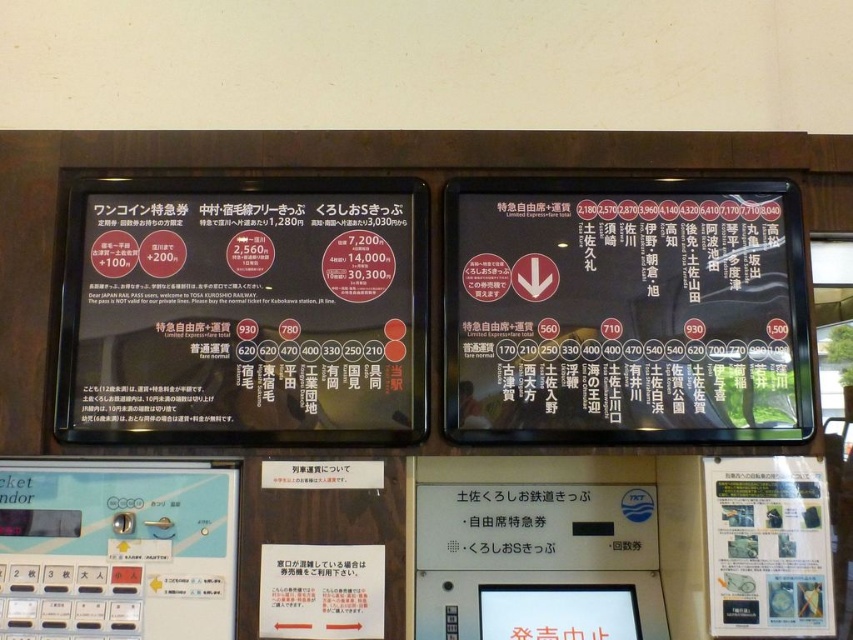
Question: Does matte black signboard at left have a lesser width compared to clear plastic sign at lower right?

Choices:
 (A) no
 (B) yes

Answer: (A)

Question: Which point appears closest to the camera in this image?

Choices:
 (A) (62, 285)
 (B) (770, 531)
 (C) (622, 289)

Answer: (B)

Question: Observing the image, what is the correct spatial positioning of matte black signboard at left in reference to black matte sign at upper right?

Choices:
 (A) left
 (B) right

Answer: (A)

Question: Observing the image, what is the correct spatial positioning of matte black signboard at left in reference to black matte sign at upper right?

Choices:
 (A) right
 (B) left

Answer: (B)

Question: Estimate the real-world distances between objects in this image. Which object is closer to the matte black signboard at left?

Choices:
 (A) clear plastic sign at lower right
 (B) black matte sign at upper right

Answer: (B)

Question: Which of the following is the closest to the observer?

Choices:
 (A) (97, 237)
 (B) (753, 550)
 (C) (776, 243)

Answer: (B)